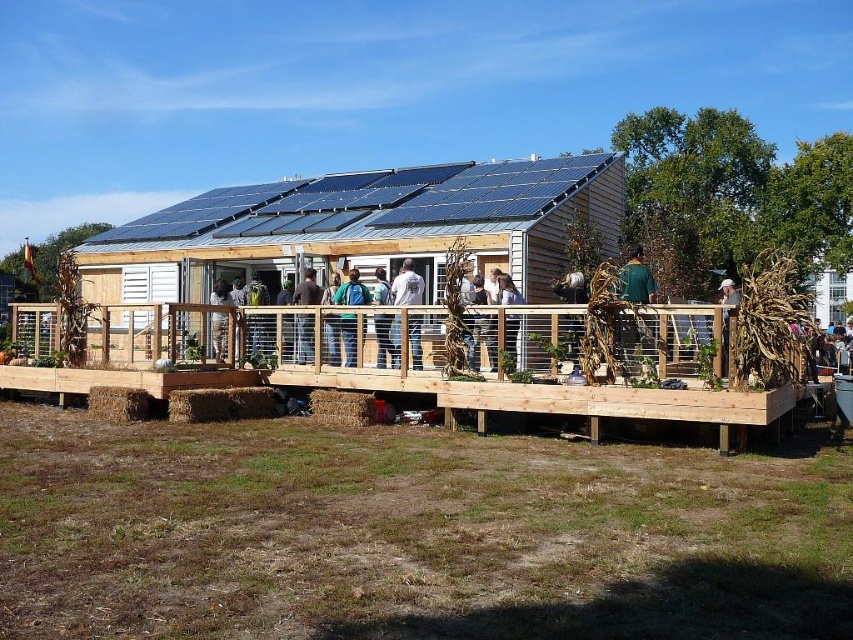
You are standing on the wooden deck in front of the eco building and notice two items. One is the green matte jacket at upper center and the other is the brown wooden post at center. From your position on the deck, which item is positioned to the left side?

The green matte jacket at upper center is to the left of the brown wooden post at center, so from your position on the deck, the green matte jacket at upper center is on the left side.

You are standing on the deck in front of the eco building and want to place a rectangular box that is 10 cm thick between the green matte jacket at upper center and the brown wooden post at center. Can the box fit between them based on their thickness?

The green matte jacket at upper center is thinner than the brown wooden post at center. Since the box is 10 cm thick, but we don not have exact measurements of the space between them, it is impossible to determine if the box will fit.

You are standing at the entrance of the eco building and see the dark brown leather jacket at center. If you walk straight ahead, will you pass by the jacket?

The dark brown leather jacket at center is located at point (305, 339). Since you are at the entrance and walking straight ahead, your path would likely pass by the jacket depending on the building layout, but the exact spatial relationship isn not provided in the scene description.